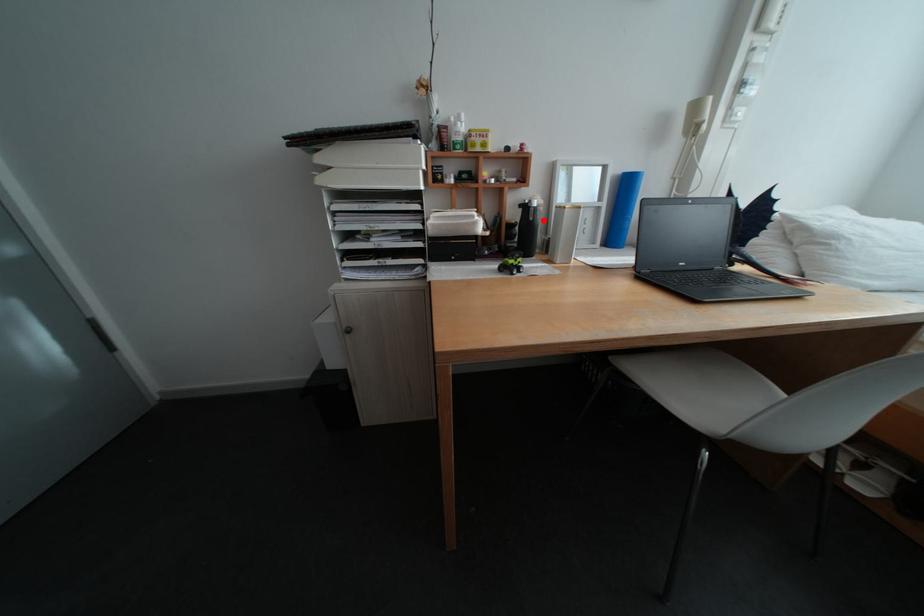
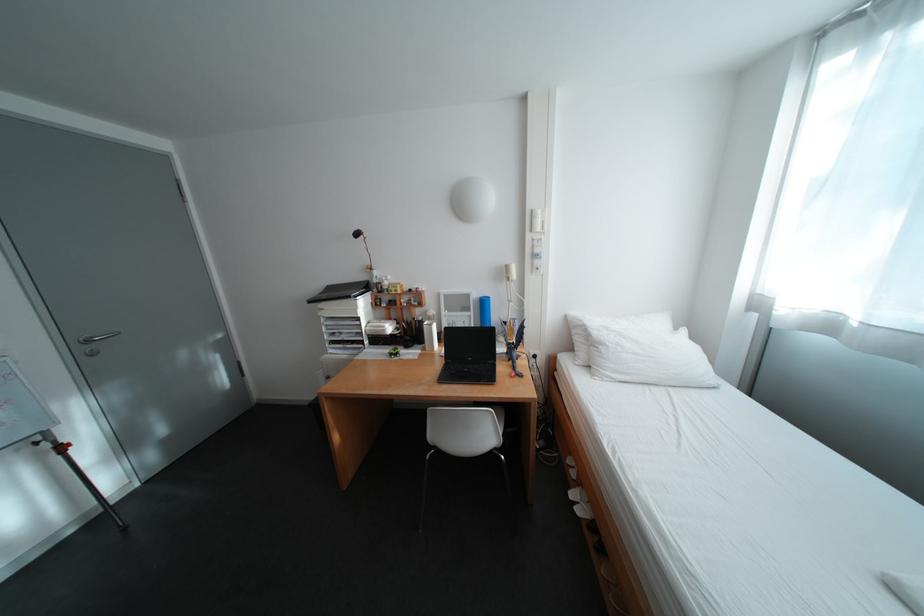
Question: I am providing you with two images of the same scene from different viewpoints. In image1, a red point is highlighted. Considering the same 3D point in image2, which of the following is correct?

Choices:
 (A) It is closer
 (B) It is farther

Answer: (B)